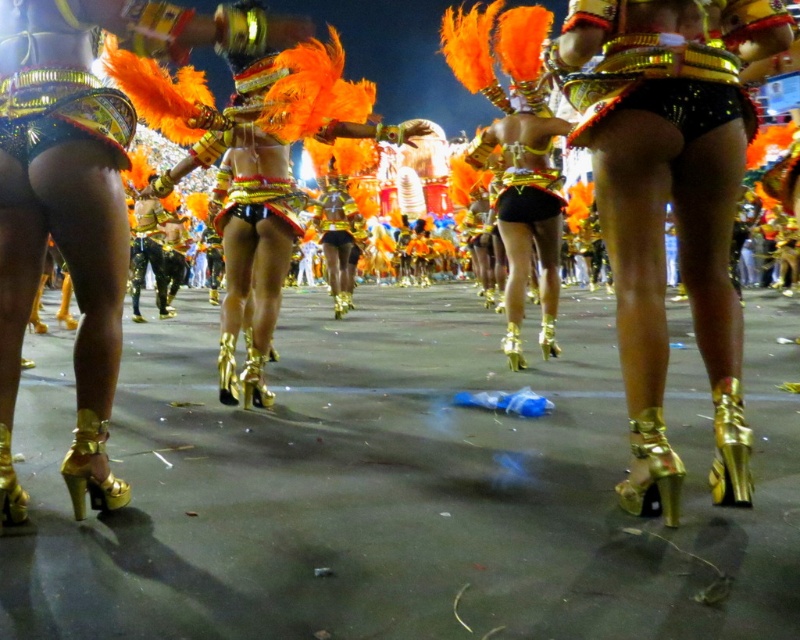
This screenshot has height=640, width=800. What do you see at coordinates (670, 202) in the screenshot?
I see `shiny gold high-heeled shoes at center` at bounding box center [670, 202].

Which is below, shiny gold high-heeled shoes at center or shiny gold shorts at center?

shiny gold high-heeled shoes at center is below.

Which is behind, point (602, 22) or point (534, 216)?

The point (534, 216) is behind.

You are a GUI agent. You are given a task and a screenshot of the screen. Output one action in this format:
    pyautogui.click(x=<x>, y=<y>)
    Task: Click on the shiny gold high-heeled shoes at center
    
    Given the screenshot: What is the action you would take?
    pyautogui.click(x=670, y=202)

Which of these two, shiny gold high-heeled shoes at center or shiny gold high-heeled boots at center, stands shorter?

shiny gold high-heeled shoes at center is shorter.

Is point (704, 273) positioned after point (274, 294)?

No, it is not.

Find the location of a particular element. This screenshot has width=800, height=640. shiny gold high-heeled shoes at center is located at coordinates pyautogui.click(x=670, y=202).

Which is behind, point (236, 120) or point (521, 218)?

The point (521, 218) is behind.

From the picture: Is shiny gold high-heeled boots at center closer to the viewer compared to shiny gold shorts at center?

Yes, shiny gold high-heeled boots at center is in front of shiny gold shorts at center.

Does point (252, 188) lie in front of point (548, 198)?

Yes, point (252, 188) is in front of point (548, 198).

Identify the location of shiny gold high-heeled boots at center. (246, 188).